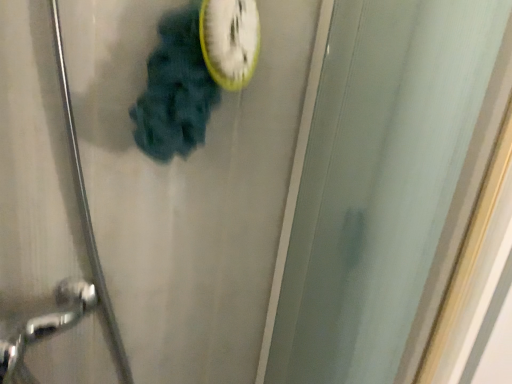
Find the location of a particular element. white plastic clock at upper center is located at coordinates (230, 40).

What do you see at coordinates (230, 40) in the screenshot? The height and width of the screenshot is (384, 512). I see `white plastic clock at upper center` at bounding box center [230, 40].

This screenshot has width=512, height=384. What do you see at coordinates (386, 185) in the screenshot?
I see `transparent glass screen door at center` at bounding box center [386, 185].

Where is `transparent glass screen door at center`? This screenshot has height=384, width=512. transparent glass screen door at center is located at coordinates (386, 185).

Locate an element on the screen. This screenshot has width=512, height=384. white plastic clock at upper center is located at coordinates (230, 40).

Can you confirm if transparent glass screen door at center is positioned to the left of white plastic clock at upper center?

No.

Considering the relative positions of transparent glass screen door at center and white plastic clock at upper center in the image provided, is transparent glass screen door at center in front of white plastic clock at upper center?

That is True.

Between point (461, 176) and point (213, 5), which one is positioned behind?

The point (213, 5) is more distant.

From the image's perspective, does transparent glass screen door at center appear lower than white plastic clock at upper center?

Yes, from the image's perspective, transparent glass screen door at center is below white plastic clock at upper center.

Looking at this image, from a real-world perspective, is transparent glass screen door at center over white plastic clock at upper center?

No.

Which of these two, transparent glass screen door at center or white plastic clock at upper center, is wider?

transparent glass screen door at center is wider.

In the scene shown: Considering the sizes of transparent glass screen door at center and white plastic clock at upper center in the image, is transparent glass screen door at center taller or shorter than white plastic clock at upper center?

In the image, transparent glass screen door at center appears to be taller than white plastic clock at upper center.

Considering the relative sizes of transparent glass screen door at center and white plastic clock at upper center in the image provided, is transparent glass screen door at center smaller than white plastic clock at upper center?

Actually, transparent glass screen door at center might be larger than white plastic clock at upper center.

Would you say transparent glass screen door at center contains white plastic clock at upper center?

Definitely not — white plastic clock at upper center is not inside transparent glass screen door at center.

Is transparent glass screen door at center next to white plastic clock at upper center and touching it?

No, transparent glass screen door at center is not touching white plastic clock at upper center.

Is white plastic clock at upper center at the back of transparent glass screen door at center?

transparent glass screen door at center is not turned away from white plastic clock at upper center.

Measure the distance from transparent glass screen door at center to white plastic clock at upper center.

The distance of transparent glass screen door at center from white plastic clock at upper center is 11.90 inches.

This screenshot has height=384, width=512. I want to click on clock on the left of the transparent glass screen door at center, so click(230, 40).

Visually, is white plastic clock at upper center positioned to the left or to the right of transparent glass screen door at center?

Based on their positions, white plastic clock at upper center is located to the left of transparent glass screen door at center.

Which object is more forward, white plastic clock at upper center or transparent glass screen door at center?

transparent glass screen door at center is closer to the camera.

Is point (236, 46) behind point (293, 219)?

No, (236, 46) is closer to viewer.

From the image's perspective, relative to transparent glass screen door at center, is white plastic clock at upper center above or below?

white plastic clock at upper center is above transparent glass screen door at center.

From a real-world perspective, between white plastic clock at upper center and transparent glass screen door at center, who is vertically higher?

In real-world perspective, white plastic clock at upper center is above.

Which object is thinner, white plastic clock at upper center or transparent glass screen door at center?

With smaller width is white plastic clock at upper center.

Is white plastic clock at upper center shorter than transparent glass screen door at center?

Yes.

Does white plastic clock at upper center have a larger size compared to transparent glass screen door at center?

No, white plastic clock at upper center is not bigger than transparent glass screen door at center.

Can we say white plastic clock at upper center lies outside transparent glass screen door at center?

Indeed, white plastic clock at upper center is completely outside transparent glass screen door at center.

Is white plastic clock at upper center touching transparent glass screen door at center?

white plastic clock at upper center is not next to transparent glass screen door at center, and they're not touching.

Could you tell me if white plastic clock at upper center is facing transparent glass screen door at center?

No, white plastic clock at upper center is not oriented towards transparent glass screen door at center.

Can you tell me how much white plastic clock at upper center and transparent glass screen door at center differ in facing direction?

0.647 degrees.

Locate an element on the screen. This screenshot has width=512, height=384. clock on the left of transparent glass screen door at center is located at coordinates (230, 40).

The image size is (512, 384). Identify the location of clock above the transparent glass screen door at center (from a real-world perspective). (230, 40).

At what (x,y) coordinates should I click in order to perform the action: click on screen door beneath the white plastic clock at upper center (from a real-world perspective). Please return your answer as a coordinate pair (x, y). Image resolution: width=512 pixels, height=384 pixels. Looking at the image, I should click on (386, 185).